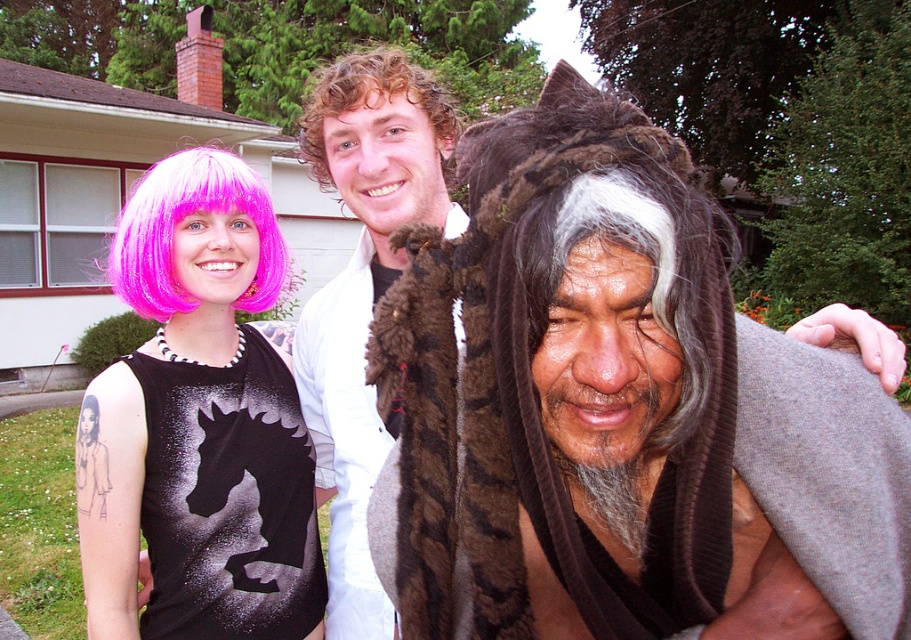
Does fuzzy brown fur hat at center have a smaller size compared to curly blonde hair at center?

Yes, fuzzy brown fur hat at center is smaller than curly blonde hair at center.

Is fuzzy brown fur hat at center positioned at the back of curly blonde hair at center?

No, fuzzy brown fur hat at center is closer to the viewer.

The image size is (911, 640). I want to click on fuzzy brown fur hat at center, so click(x=566, y=388).

Is pink wig at upper left shorter than curly blonde hair at center?

Yes.

Who is more distant from viewer, [200,244] or [362,51]?

The point [362,51] is more distant.

This screenshot has width=911, height=640. I want to click on pink wig at upper left, so click(x=200, y=422).

Which is more to the left, fuzzy brown fur hat at center or pink wig at upper left?

From the viewer's perspective, pink wig at upper left appears more on the left side.

Is fuzzy brown fur hat at center smaller than pink wig at upper left?

Correct, fuzzy brown fur hat at center occupies less space than pink wig at upper left.

Who is more distant from viewer, (468, 586) or (126, 540)?

Positioned behind is point (126, 540).

Image resolution: width=911 pixels, height=640 pixels. Identify the location of fuzzy brown fur hat at center. (566, 388).